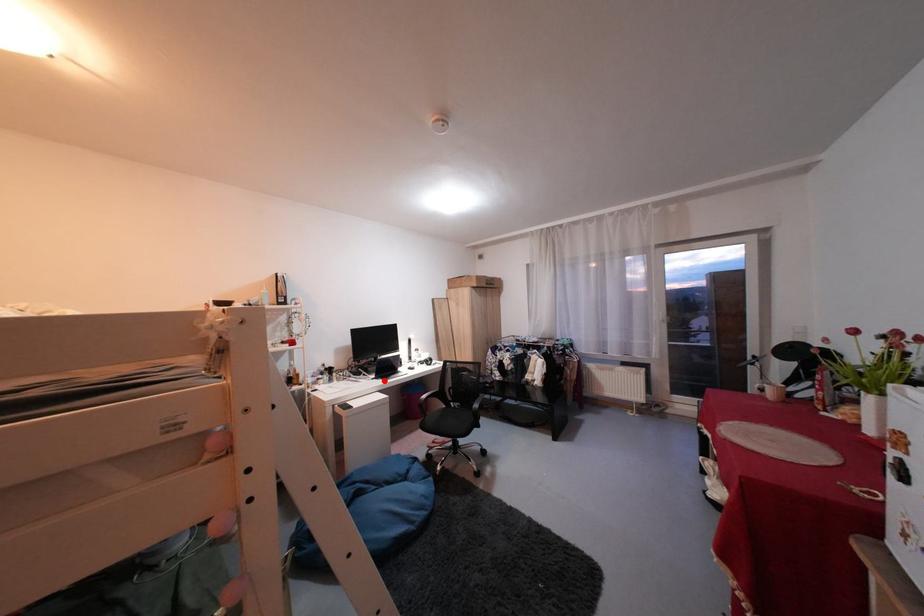
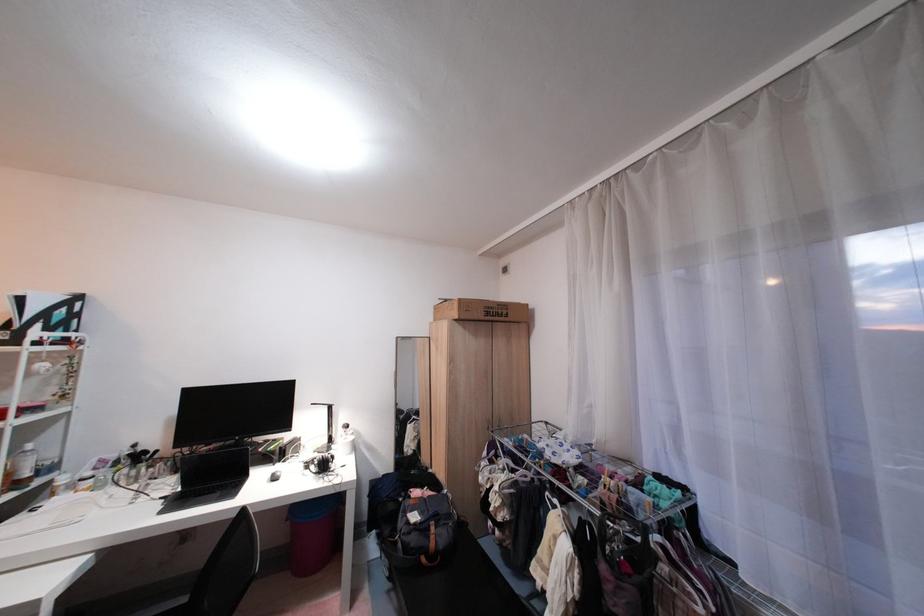
Locate, in the second image, the point that corresponds to the highlighted location in the first image.

(172, 500)